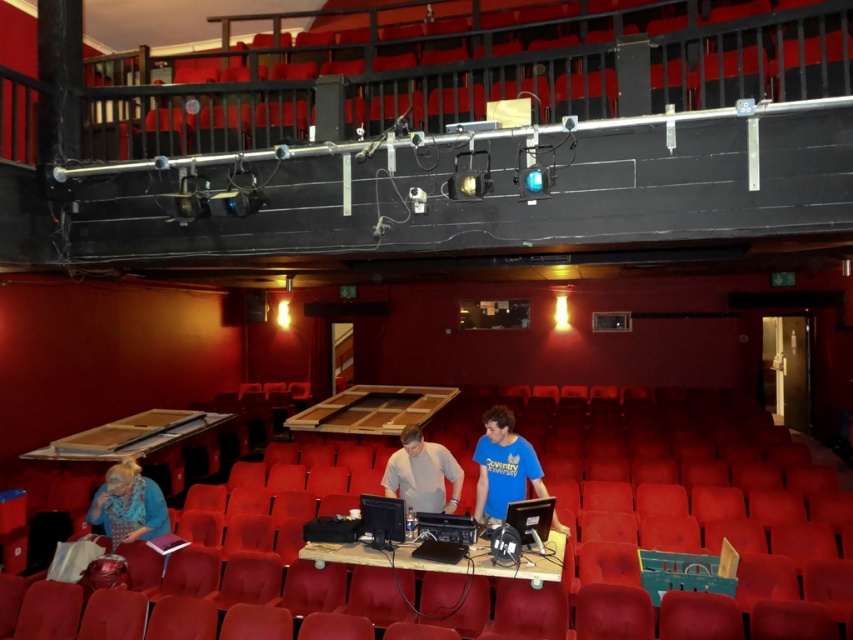
You are sitting in the theater and want to know which object takes up more horizontal space. Which one is wider between the light gray shirt at center and the blue fabric at lower left?

The blue fabric at lower left is wider than the light gray shirt at center.